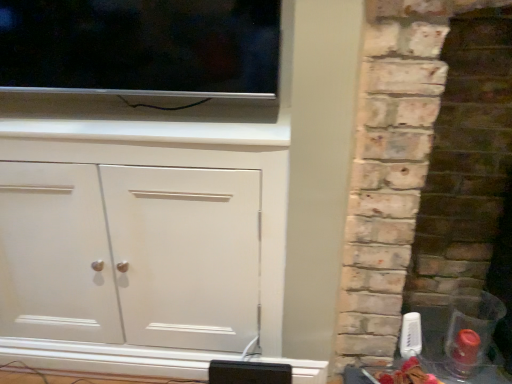
Identify the location of white matte cabinet at center. Image resolution: width=512 pixels, height=384 pixels. (142, 244).

This screenshot has height=384, width=512. What do you see at coordinates (141, 47) in the screenshot? I see `flat screen tv at upper left` at bounding box center [141, 47].

Where is `white matte cabinet at center`? The image size is (512, 384). white matte cabinet at center is located at coordinates (142, 244).

Could you tell me if flat screen tv at upper left is turned towards white matte cabinet at center?

No, flat screen tv at upper left is not facing towards white matte cabinet at center.

Can you confirm if flat screen tv at upper left is bigger than white matte cabinet at center?

No.

Is flat screen tv at upper left positioned behind white matte cabinet at center?

No, it is not.

From the image's perspective, is flat screen tv at upper left under white matte cabinet at center?

Actually, flat screen tv at upper left appears above white matte cabinet at center in the image.

Locate an element on the screen. cupboard on the left side of flat screen tv at upper left is located at coordinates (142, 244).

Which is closer, (224, 275) or (260, 14)?

The point (260, 14) is more forward.

Is the surface of white matte cabinet at center in direct contact with flat screen tv at upper left?

There is a gap between white matte cabinet at center and flat screen tv at upper left.

Considering the relative sizes of white matte cabinet at center and flat screen tv at upper left in the image provided, is white matte cabinet at center thinner than flat screen tv at upper left?

Incorrect, the width of white matte cabinet at center is not less than that of flat screen tv at upper left.

Can you tell me how much rustic stone fireplace at right and white matte cabinet at center differ in facing direction?

0.127 degrees separate the facing orientations of rustic stone fireplace at right and white matte cabinet at center.

Would you consider rustic stone fireplace at right to be distant from white matte cabinet at center?

They are positioned close to each other.

Looking at their sizes, would you say rustic stone fireplace at right is wider or thinner than white matte cabinet at center?

rustic stone fireplace at right is wider than white matte cabinet at center.

Which is behind, point (423, 123) or point (87, 288)?

Point (87, 288)

You are a GUI agent. You are given a task and a screenshot of the screen. Output one action in this format:
    pyautogui.click(x=<x>, y=<y>)
    Task: Click on the tv show located on the left of rustic stone fireplace at right
    Image resolution: width=512 pixels, height=384 pixels.
    Given the screenshot: What is the action you would take?
    pyautogui.click(x=141, y=47)

From a real-world perspective, which object rests below the other?

rustic stone fireplace at right is physically lower.

Is there a large distance between flat screen tv at upper left and rustic stone fireplace at right?

That's not correct — flat screen tv at upper left is a little close to rustic stone fireplace at right.

Considering the positions of objects flat screen tv at upper left and rustic stone fireplace at right in the image provided, who is more to the right, flat screen tv at upper left or rustic stone fireplace at right?

From the viewer's perspective, rustic stone fireplace at right appears more on the right side.

Is rustic stone fireplace at right further to camera compared to flat screen tv at upper left?

No, the depth of rustic stone fireplace at right is less than that of flat screen tv at upper left.

How distant is rustic stone fireplace at right from flat screen tv at upper left?

rustic stone fireplace at right is 21.59 inches from flat screen tv at upper left.

Choose the correct answer: Is rustic stone fireplace at right inside flat screen tv at upper left or outside it?

rustic stone fireplace at right cannot be found inside flat screen tv at upper left.

Considering the positions of objects rustic stone fireplace at right and flat screen tv at upper left in the image provided, who is more to the left, rustic stone fireplace at right or flat screen tv at upper left?

flat screen tv at upper left.

Is white matte cabinet at center positioned beyond the bounds of rustic stone fireplace at right?

Absolutely, white matte cabinet at center is external to rustic stone fireplace at right.

Does white matte cabinet at center have a larger size compared to rustic stone fireplace at right?

No.

Considering the positions of point (159, 295) and point (386, 294), is point (159, 295) closer or farther from the camera than point (386, 294)?

Point (159, 295) is farther from the camera than point (386, 294).

How many degrees apart are the facing directions of white matte cabinet at center and rustic stone fireplace at right?

The angular difference between white matte cabinet at center and rustic stone fireplace at right is 0.127 degrees.

At what (x,y) coordinates should I click in order to perform the action: click on tv show located above the white matte cabinet at center (from a real-world perspective). Please return your answer as a coordinate pair (x, y). The width and height of the screenshot is (512, 384). Looking at the image, I should click on (141, 47).

Where is `cupboard behind the flat screen tv at upper left`? cupboard behind the flat screen tv at upper left is located at coordinates (142, 244).

Which object lies further to the anchor point white matte cabinet at center, rustic stone fireplace at right or flat screen tv at upper left?

Among the two, rustic stone fireplace at right is located further to white matte cabinet at center.

Considering their positions, is flat screen tv at upper left positioned closer to white matte cabinet at center than rustic stone fireplace at right?

flat screen tv at upper left.

Considering their positions, is flat screen tv at upper left positioned closer to rustic stone fireplace at right than white matte cabinet at center?

The object closer to rustic stone fireplace at right is white matte cabinet at center.

Based on the photo, looking at the image, which one is located further to rustic stone fireplace at right, white matte cabinet at center or flat screen tv at upper left?

The object further to rustic stone fireplace at right is flat screen tv at upper left.

In the scene shown: Estimate the real-world distances between objects in this image. Which object is closer to flat screen tv at upper left, white matte cabinet at center or rustic stone fireplace at right?

white matte cabinet at center is positioned closer to the anchor flat screen tv at upper left.

From the image, which object appears to be farther from flat screen tv at upper left, rustic stone fireplace at right or white matte cabinet at center?

The object further to flat screen tv at upper left is rustic stone fireplace at right.

The height and width of the screenshot is (384, 512). In order to click on tv show between white matte cabinet at center and rustic stone fireplace at right from left to right in this screenshot , I will do `click(141, 47)`.